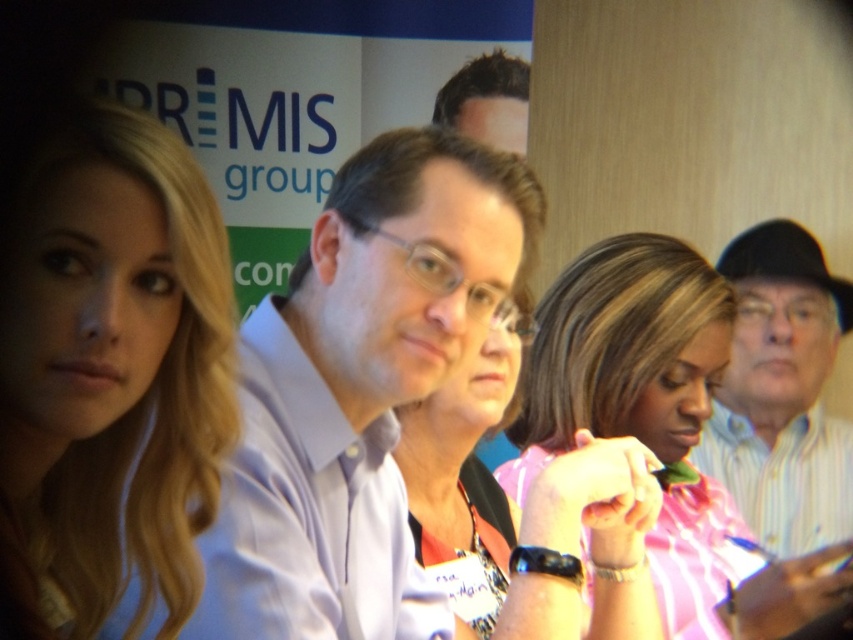
You are attending a formal meeting and need to check the time discreetly. You see a pink striped shirt at center and a matte black watch at center. Which object is more accessible to reach quickly?

The pink striped shirt at center is positioned over the matte black watch at center, so the watch is less accessible. To check the time discreetly, you should reach for the matte black watch at center but since it is under the shirt, it might be harder to access quickly.

You are a photographer trying to adjust your camera focus. The camera is currently focused on the center of the image. The coordinates given are in a normalized system where the bottom left corner is the origin. Where should you move the focus to capture the blonde hair at left?

The coordinates for the blonde hair at left are at point 0.591 on the x axis and 0.130 on the y axis. Since the bottom left corner is the origin, you should move the focus to the position at 0.591 on the x axis and 0.130 on the y axis to capture the blonde hair at left.